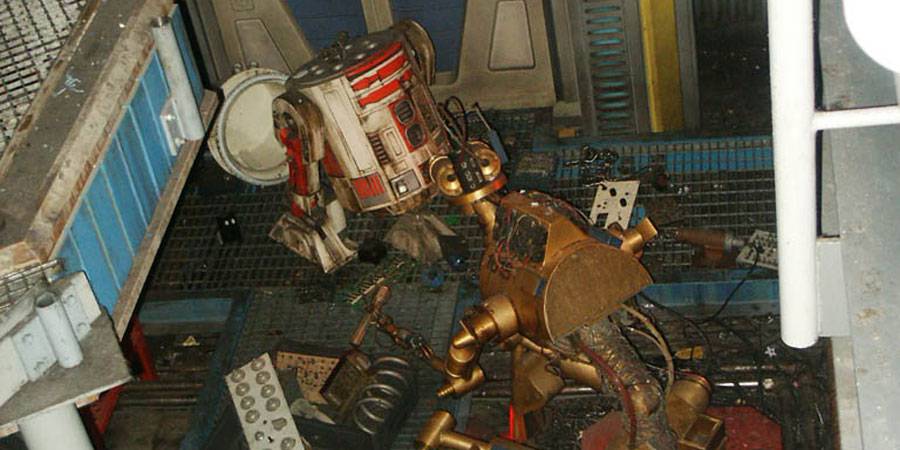
The width and height of the screenshot is (900, 450). In order to click on remote in this screenshot , I will do `click(265, 405)`.